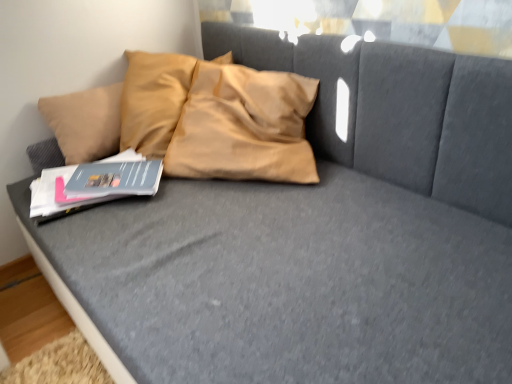
Find the location of `free space to the left of matte blue paperback book at center-left, marked as the 1th paperback book in a back-to-front arrangement`. free space to the left of matte blue paperback book at center-left, marked as the 1th paperback book in a back-to-front arrangement is located at coordinates (49, 189).